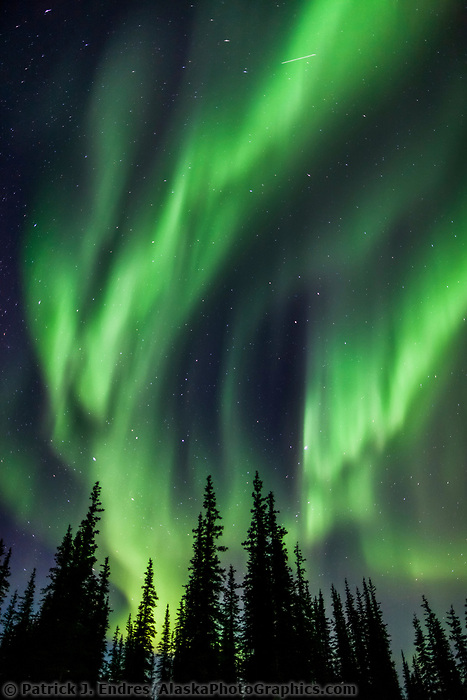
Where is `green lights`? green lights is located at coordinates (282, 106), (109, 358).